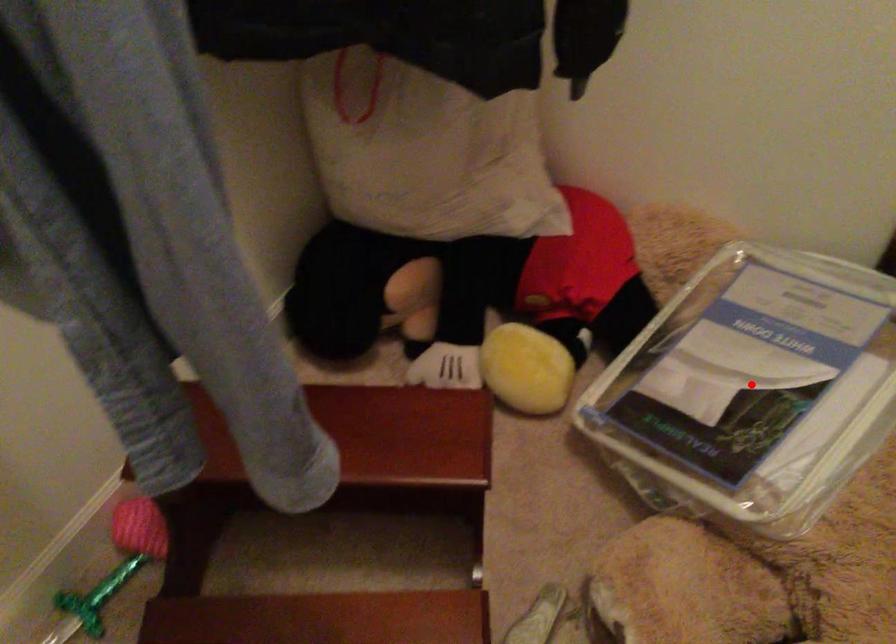
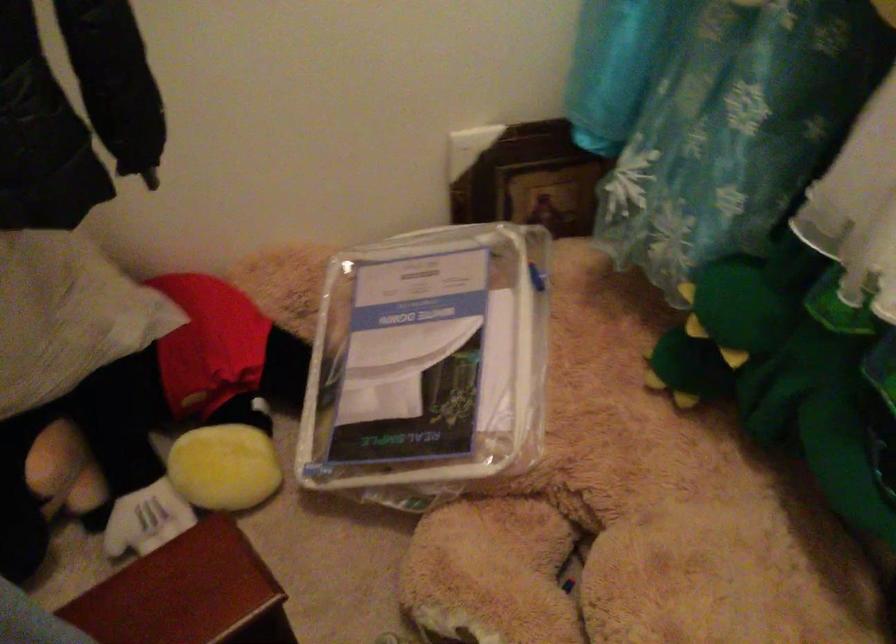
In the second image, find the point that corresponds to the highlighted location in the first image.

(427, 365)